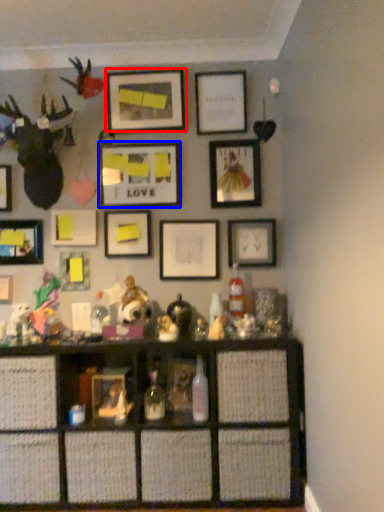
Question: Which of the following is the closest to the observer, picture frame (highlighted by a red box) or picture frame (highlighted by a blue box)?

Choices:
 (A) picture frame
 (B) picture frame

Answer: (A)